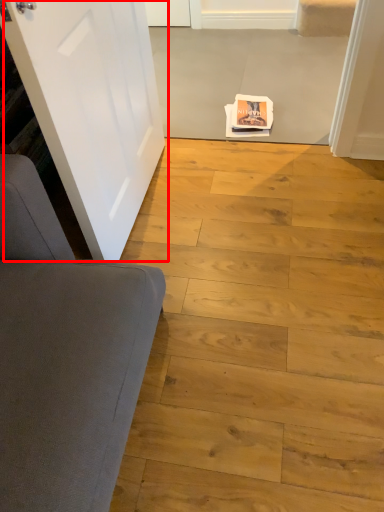
Question: From the image's perspective, considering the relative positions of door (annotated by the red box) and plank in the image provided, where is door (annotated by the red box) located with respect to the staircase?

Choices:
 (A) above
 (B) below

Answer: (A)